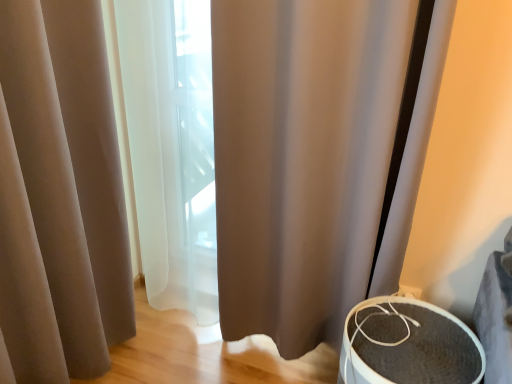
Question: From the image's perspective, is textured gray speaker at lower right above matte beige curtain at left?

Choices:
 (A) yes
 (B) no

Answer: (B)

Question: Is textured gray speaker at lower right facing away from matte beige curtain at left?

Choices:
 (A) no
 (B) yes

Answer: (A)

Question: Considering the relative sizes of textured gray speaker at lower right and matte beige curtain at left in the image provided, is textured gray speaker at lower right taller than matte beige curtain at left?

Choices:
 (A) yes
 (B) no

Answer: (B)

Question: Is textured gray speaker at lower right closer to camera compared to matte beige curtain at left?

Choices:
 (A) no
 (B) yes

Answer: (A)

Question: Can you see textured gray speaker at lower right touching matte beige curtain at left?

Choices:
 (A) yes
 (B) no

Answer: (B)

Question: Considering the positions of matte beige curtain at left and brown fabric shower curtain at center in the image, is matte beige curtain at left taller or shorter than brown fabric shower curtain at center?

Choices:
 (A) tall
 (B) short

Answer: (B)

Question: Is point (56, 67) closer or farther from the camera than point (329, 59)?

Choices:
 (A) farther
 (B) closer

Answer: (A)

Question: Considering the positions of matte beige curtain at left and brown fabric shower curtain at center in the image, is matte beige curtain at left wider or thinner than brown fabric shower curtain at center?

Choices:
 (A) wide
 (B) thin

Answer: (B)

Question: Do you think matte beige curtain at left is within brown fabric shower curtain at center, or outside of it?

Choices:
 (A) inside
 (B) outside

Answer: (B)

Question: Would you say brown fabric shower curtain at center is inside or outside matte beige curtain at left?

Choices:
 (A) inside
 (B) outside

Answer: (B)

Question: From their relative heights in the image, would you say brown fabric shower curtain at center is taller or shorter than matte beige curtain at left?

Choices:
 (A) short
 (B) tall

Answer: (B)

Question: In the image, is brown fabric shower curtain at center on the left side or the right side of matte beige curtain at left?

Choices:
 (A) left
 (B) right

Answer: (B)

Question: From a real-world perspective, is brown fabric shower curtain at center above or below matte beige curtain at left?

Choices:
 (A) below
 (B) above

Answer: (B)

Question: From the image's perspective, is matte beige curtain at left positioned above or below textured gray speaker at lower right?

Choices:
 (A) above
 (B) below

Answer: (A)

Question: From a real-world perspective, is matte beige curtain at left positioned above or below textured gray speaker at lower right?

Choices:
 (A) above
 (B) below

Answer: (A)